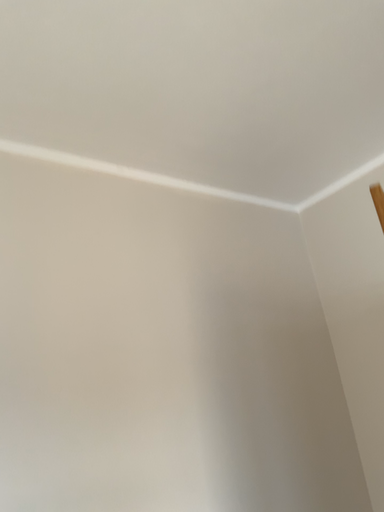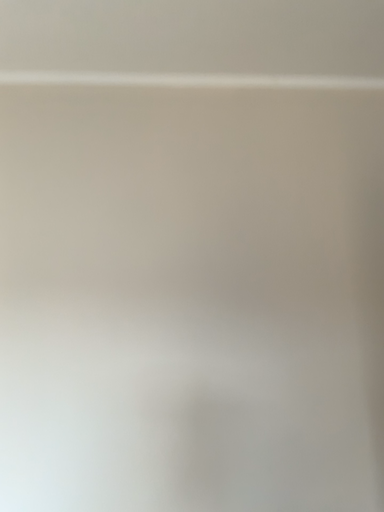
Question: Which way did the camera rotate in the video?

Choices:
 (A) rotated left
 (B) rotated right

Answer: (A)